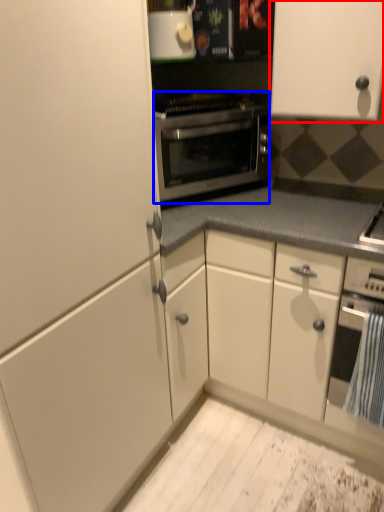
Question: Which of the following is the farthest to the observer, cabinetry (highlighted by a red box) or oven (highlighted by a blue box)?

Choices:
 (A) cabinetry
 (B) oven

Answer: (B)